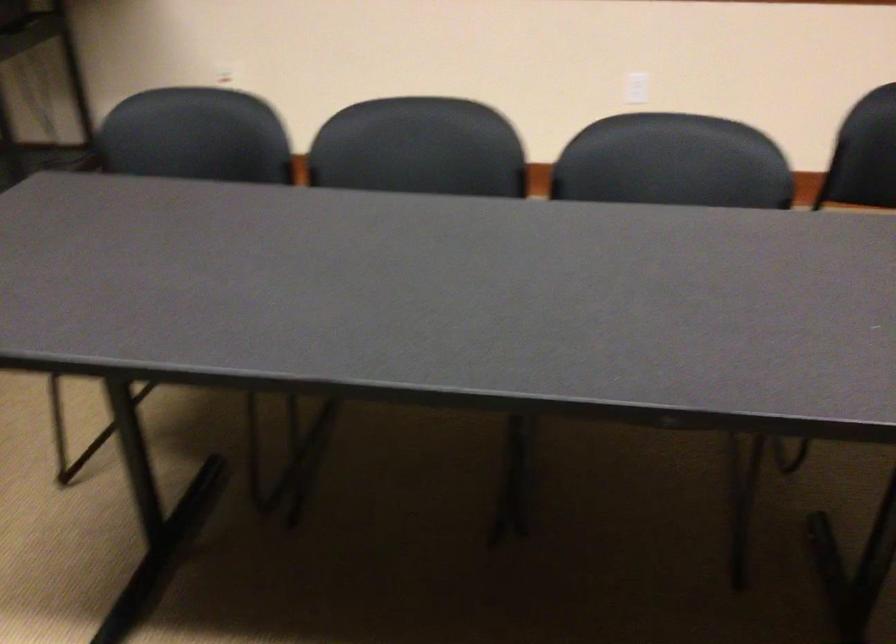
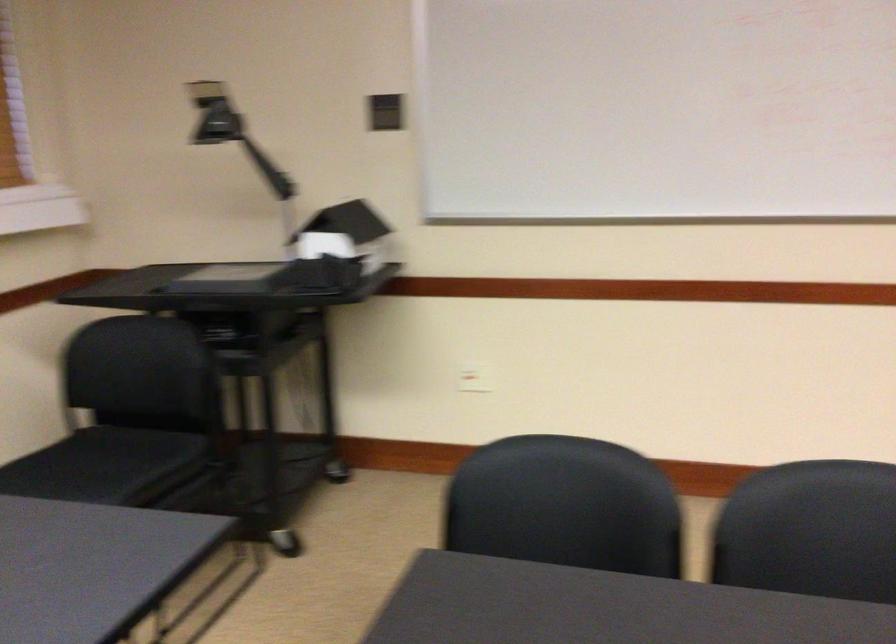
Question: Based on the continuous images, in which direction is the camera rotating? Reply with the corresponding letter.

Choices:
 (A) Left
 (B) Right
 (C) Up
 (D) Down

Answer: (C)